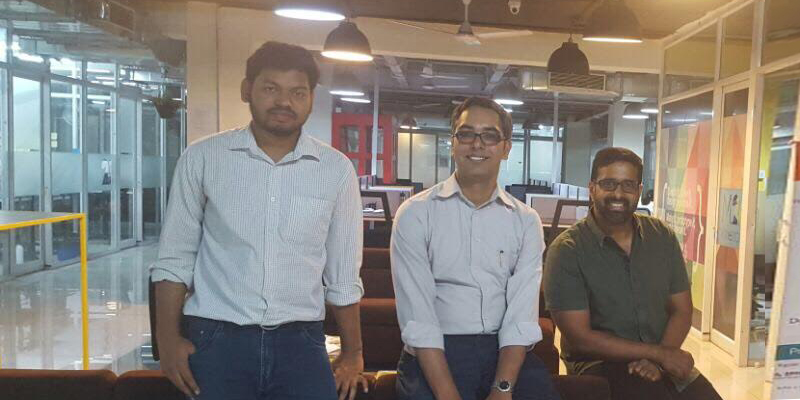
Locate an element on the screen. doors is located at coordinates (30, 136), (73, 127), (102, 130), (142, 139).